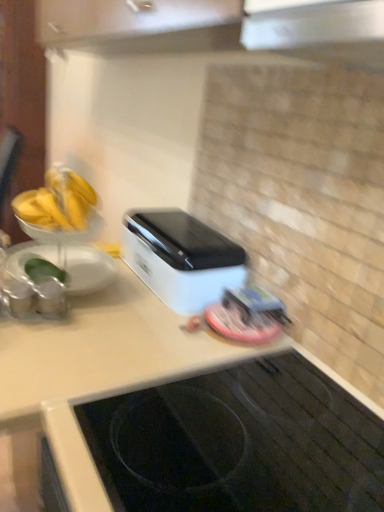
Question: Does white plastic toaster at center turn towards white glossy countertop at lower center?

Choices:
 (A) no
 (B) yes

Answer: (A)

Question: Is white plastic toaster at center with white glossy countertop at lower center?

Choices:
 (A) no
 (B) yes

Answer: (A)

Question: Does white plastic toaster at center have a smaller size compared to white glossy countertop at lower center?

Choices:
 (A) yes
 (B) no

Answer: (A)

Question: Does white plastic toaster at center have a lesser height compared to white glossy countertop at lower center?

Choices:
 (A) yes
 (B) no

Answer: (A)

Question: Is white plastic toaster at center closer to the viewer compared to white glossy countertop at lower center?

Choices:
 (A) yes
 (B) no

Answer: (B)

Question: Is white glossy countertop at lower center at the back of white plastic toaster at center?

Choices:
 (A) yes
 (B) no

Answer: (B)

Question: From a real-world perspective, is white glossy countertop at lower center over white plastic toaster at center?

Choices:
 (A) yes
 (B) no

Answer: (B)

Question: Is white glossy countertop at lower center beside white plastic toaster at center?

Choices:
 (A) yes
 (B) no

Answer: (B)

Question: Can white plastic toaster at center be found inside white glossy countertop at lower center?

Choices:
 (A) yes
 (B) no

Answer: (B)

Question: Considering the relative positions of white glossy countertop at lower center and white plastic toaster at center in the image provided, is white glossy countertop at lower center to the right of white plastic toaster at center from the viewer's perspective?

Choices:
 (A) yes
 (B) no

Answer: (A)

Question: Is white glossy countertop at lower center outside white plastic toaster at center?

Choices:
 (A) yes
 (B) no

Answer: (A)

Question: Is white glossy countertop at lower center wider than white plastic toaster at center?

Choices:
 (A) no
 (B) yes

Answer: (B)

Question: Is white glossy countertop at lower center situated inside white plastic toaster at center or outside?

Choices:
 (A) outside
 (B) inside

Answer: (A)